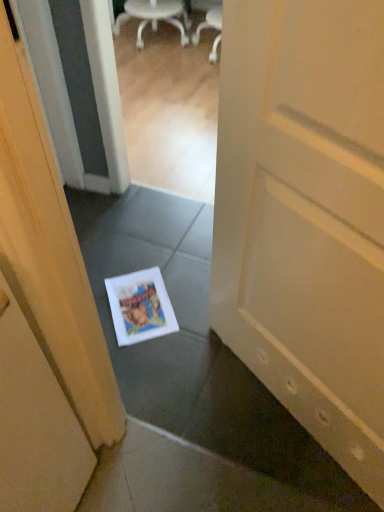
Image resolution: width=384 pixels, height=512 pixels. Identify the location of vacant area on top of white matte magazine at center (from a real-world perspective). (140, 305).